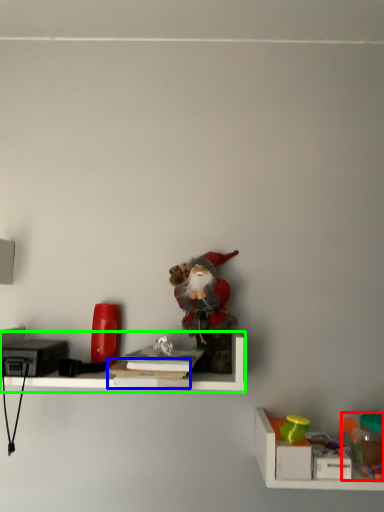
Question: Which object is the farthest from toy (highlighted by a red box)? Choose among these: book (highlighted by a blue box) or shelf (highlighted by a green box).

Choices:
 (A) book
 (B) shelf

Answer: (A)